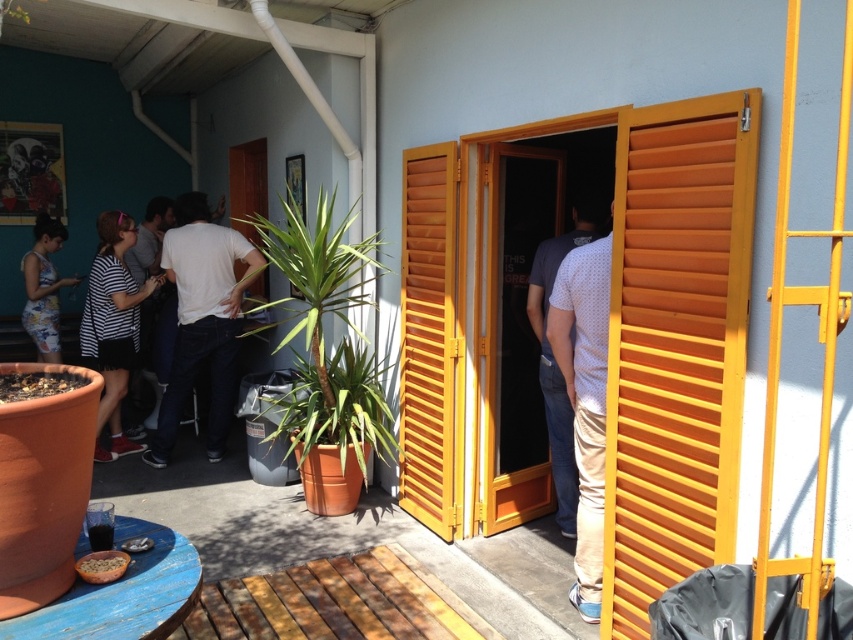
From the picture: You are a photographer trying to capture both the white dotted shirt at center and the striped fabric shirt at left in a single shot. Since the camera can only focus on one shirt at a time, which shirt should you focus on to ensure the other is still visible in the background?

You should focus on the white dotted shirt at center because it is positioned over the striped fabric shirt at left, meaning the striped fabric shirt at left will be in the background and still visible.

You are a photographer trying to capture both the white dotted shirt at center and the striped fabric shirt at left in a single frame. Given their sizes, which shirt should you focus on to ensure both are clearly visible in the photo?

Since the white dotted shirt at center is smaller than the striped fabric shirt at left, you should focus on the white dotted shirt at center to ensure both are clearly visible in the photo.

You are standing at the entrance with bright yellow wooden shutters and want to greet the person wearing the white dotted shirt at center. In which direction should you walk from the entrance to reach them?

The white dotted shirt at center is located at point 0.553 on the x and 0.648 on the y coordinate, so you should walk towards the center area from the entrance to reach them.